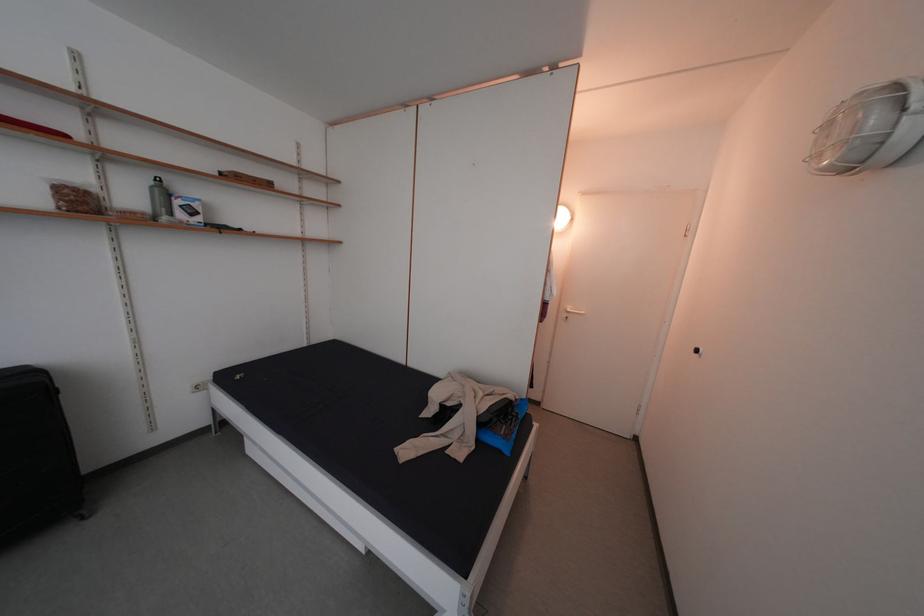
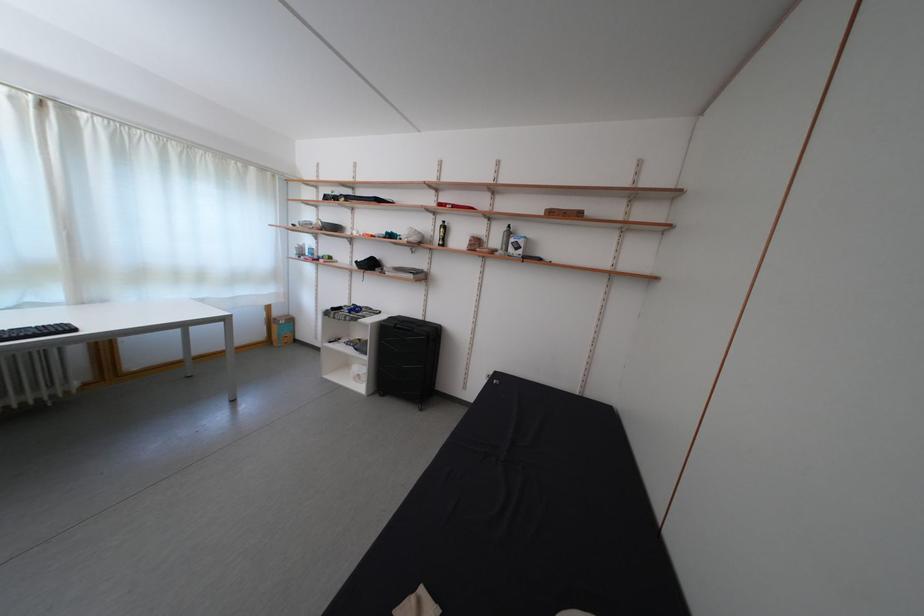
Find the pixel in the second image that matches [140,203] in the first image.

(505, 246)